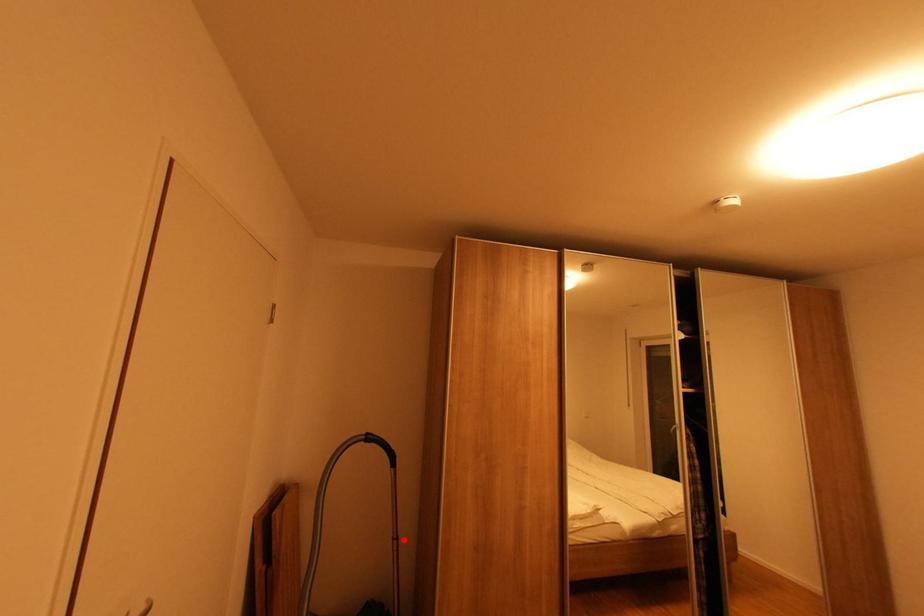
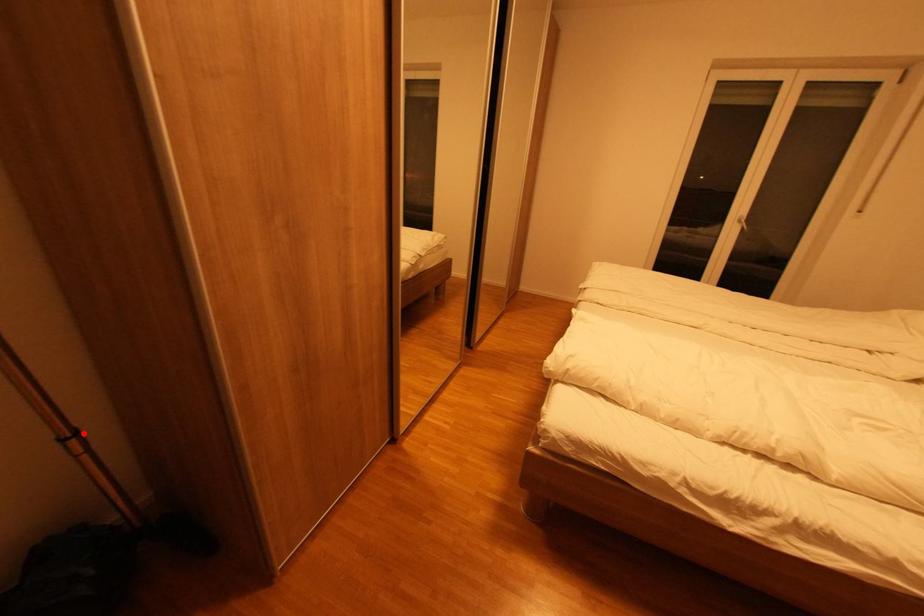
I am providing you with two images of the same scene from different viewpoints. A red point is marked on the first image and another point is marked on the second image. Does the point marked in image1 correspond to the same location as the one in image2?

Yes